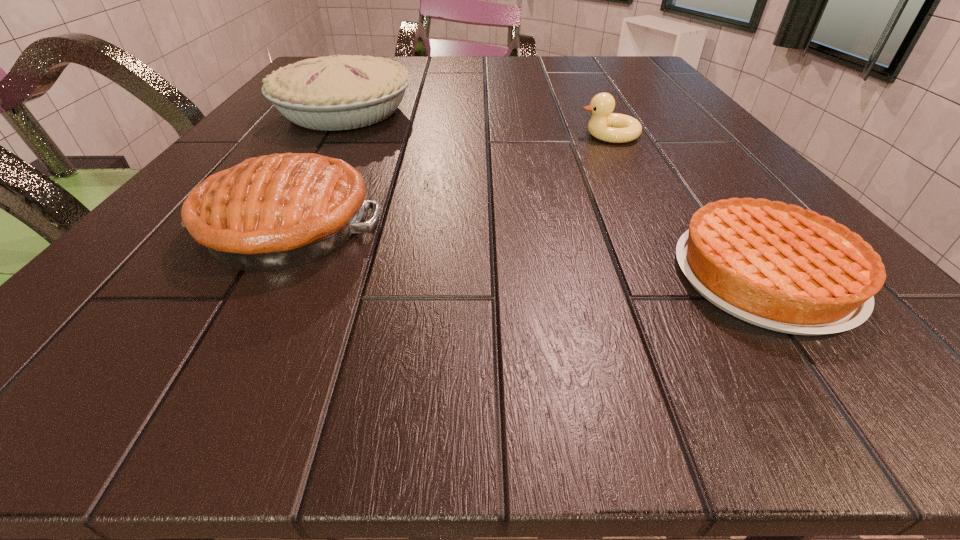
The image size is (960, 540). Identify the location of duckling located in the right edge section of the desktop. (604, 125).

Identify the location of pie situated at the right edge. (780, 267).

Image resolution: width=960 pixels, height=540 pixels. Identify the location of object at the near right corner. tap(780, 267).

Image resolution: width=960 pixels, height=540 pixels. Identify the location of vacant space at the far edge. (470, 62).

Locate an element on the screen. vacant space at the near edge is located at coordinates (666, 319).

Locate an element on the screen. This screenshot has height=540, width=960. free space at the left edge of the desktop is located at coordinates (242, 145).

This screenshot has width=960, height=540. I want to click on vacant area at the right edge of the desktop, so click(682, 160).

Where is `vacant space at the near left corner of the desktop`? vacant space at the near left corner of the desktop is located at coordinates (165, 369).

What are the coordinates of `vacant area at the far right corner` in the screenshot? It's located at (605, 80).

Where is `empty space between the farthest pie and the second shortest object`? empty space between the farthest pie and the second shortest object is located at coordinates point(477,123).